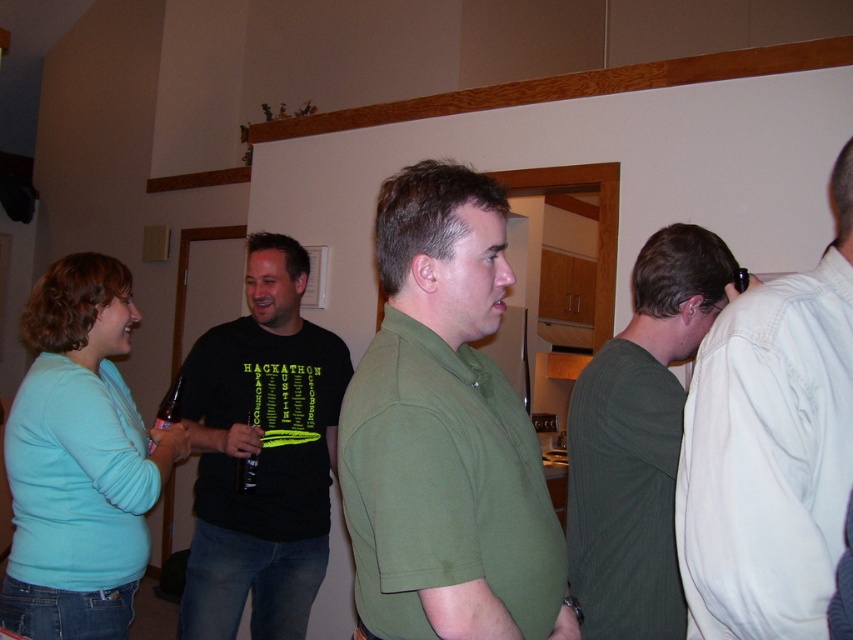
Looking at this image, you are a photographer trying to capture a candid shot of the two people at the center of the image. The green matte shirt at center and the dark green sweater at center are both in your frame. Since you want to focus on the person closer to you, which one should you aim your camera at?

The green matte shirt at center is closer to the viewer than the dark green sweater at center, so you should aim your camera at the green matte shirt at center to focus on the person closer to you.

You are a photographer trying to capture a candid shot of the white cotton shirt at right and the dark green sweater at center. Since you want to include both in the frame, which one should you focus on first to ensure they are both in focus?

The white cotton shirt at right is not as tall as dark green sweater at center, so you should focus on the dark green sweater at center first to ensure both are in focus.